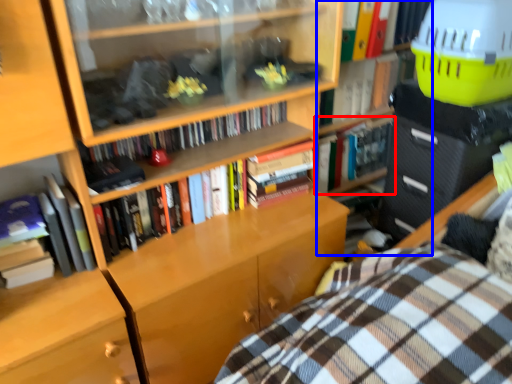
Question: Which of the following is the closest to the observer, book (highlighted by a red box) or bookshelf (highlighted by a blue box)?

Choices:
 (A) book
 (B) bookshelf

Answer: (B)